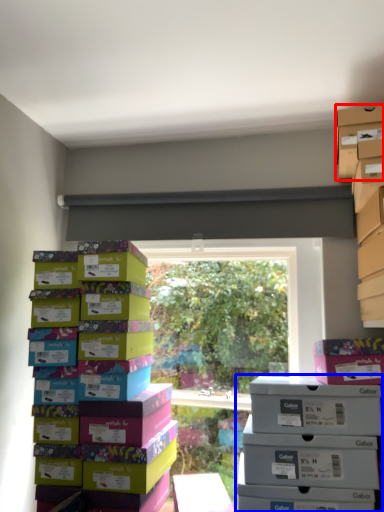
Question: Which of the following is the closest to the observer, storage box (highlighted by a red box) or storage box (highlighted by a blue box)?

Choices:
 (A) storage box
 (B) storage box

Answer: (B)